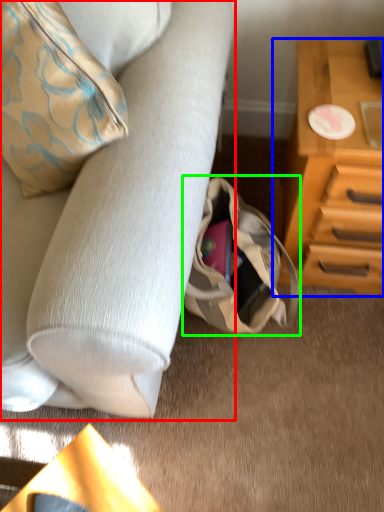
Question: Which is nearer to the studio couch (highlighted by a red box)? chest of drawers (highlighted by a blue box) or handbag (highlighted by a green box).

Choices:
 (A) chest of drawers
 (B) handbag

Answer: (B)